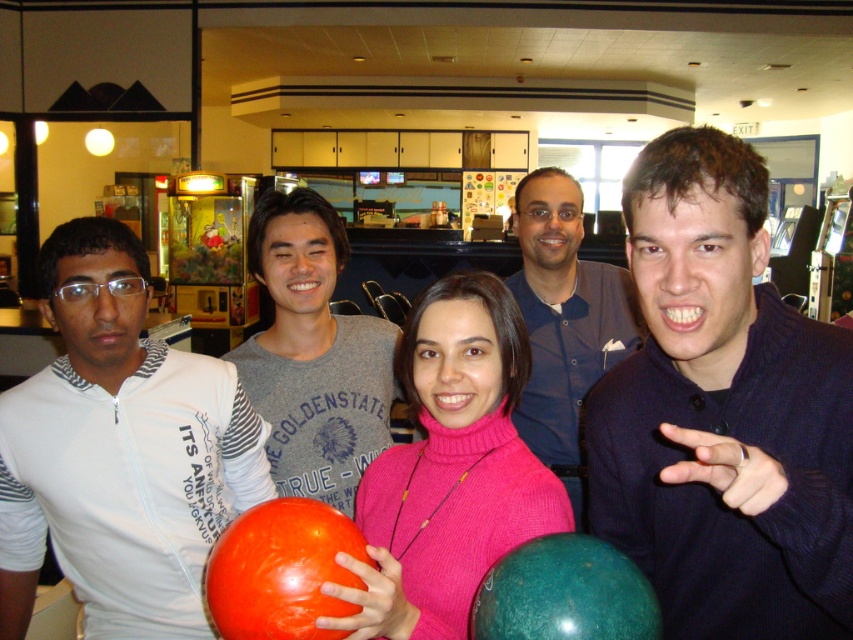
I want to click on pink turtleneck sweater at center, so click(x=450, y=468).

Does pink turtleneck sweater at center appear on the left side of matte gray t-shirt at center?

In fact, pink turtleneck sweater at center is to the right of matte gray t-shirt at center.

Find the location of `pink turtleneck sweater at center`. pink turtleneck sweater at center is located at coordinates (450, 468).

Can you confirm if pink turtleneck sweater at center is bigger than blue button-down shirt at center?

No.

What do you see at coordinates (450, 468) in the screenshot?
I see `pink turtleneck sweater at center` at bounding box center [450, 468].

Does point (413, 381) come in front of point (577, 333)?

That is True.

Where is `pink turtleneck sweater at center`? Image resolution: width=853 pixels, height=640 pixels. pink turtleneck sweater at center is located at coordinates (450, 468).

Is point (744, 260) positioned in front of point (471, 275)?

Yes, point (744, 260) is closer to viewer.

Is dark blue sweater at right thinner than pink turtleneck sweater at center?

Correct, dark blue sweater at right's width is less than pink turtleneck sweater at center's.

Does point (775, 488) come closer to viewer compared to point (451, 397)?

Yes, it is in front of point (451, 397).

The width and height of the screenshot is (853, 640). What are the coordinates of `dark blue sweater at right` in the screenshot? It's located at (722, 412).